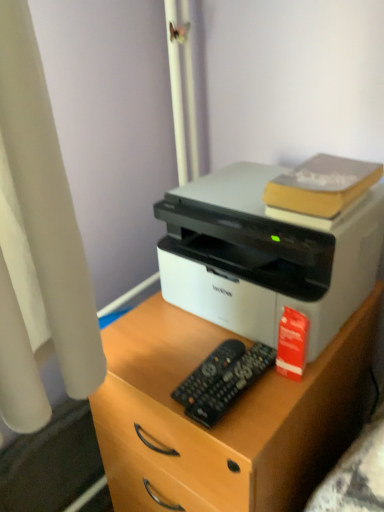
Find the location of a particular element. This screenshot has height=512, width=384. free space above yellow matte book at upper right, arranged as the 1th book when viewed from the top (from a real-world perspective) is located at coordinates (326, 168).